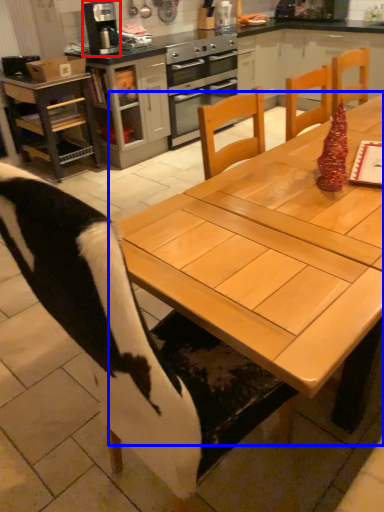
Question: Which object is further to the camera taking this photo, kitchen appliance (highlighted by a red box) or table (highlighted by a blue box)?

Choices:
 (A) kitchen appliance
 (B) table

Answer: (A)